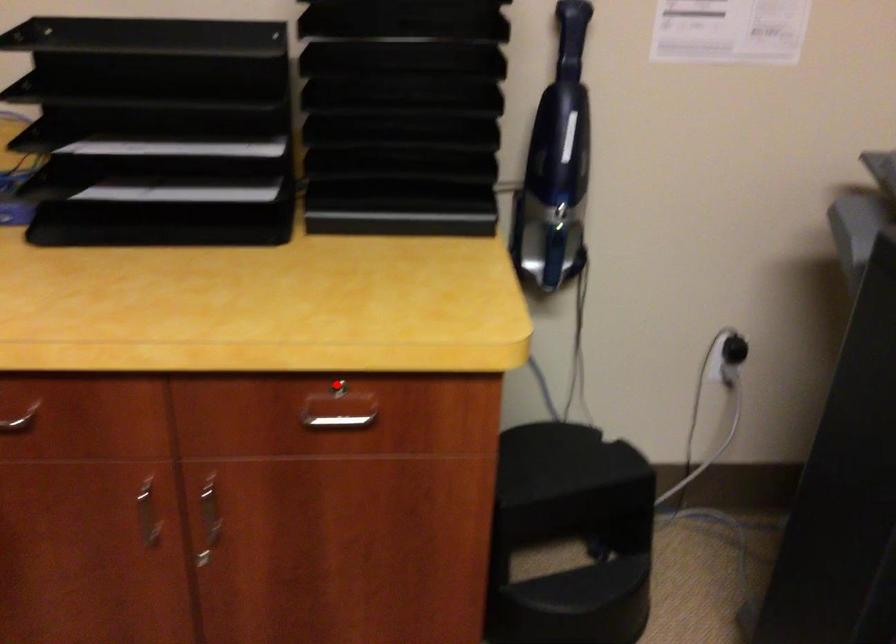
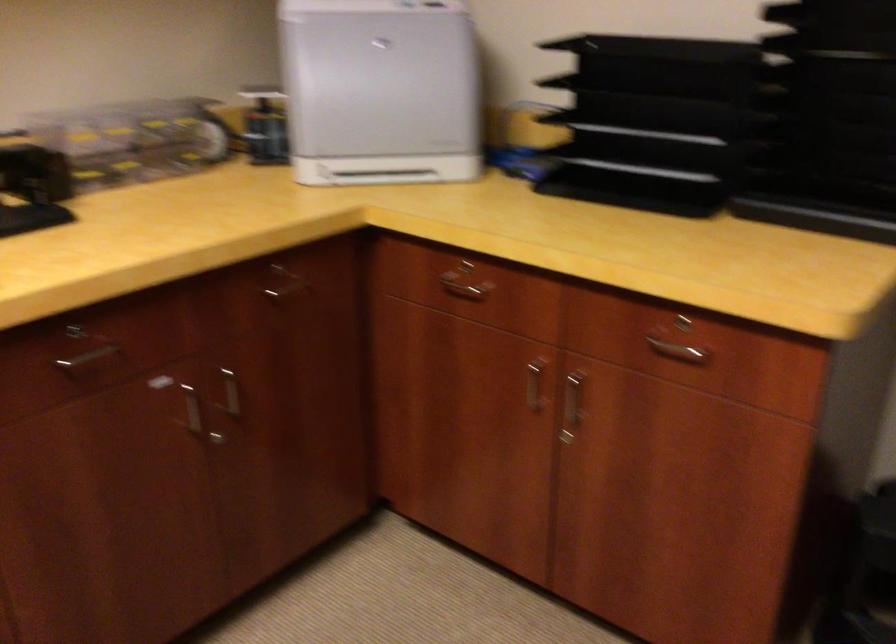
Where in the second image is the point corresponding to the highlighted location from the first image?

(686, 321)